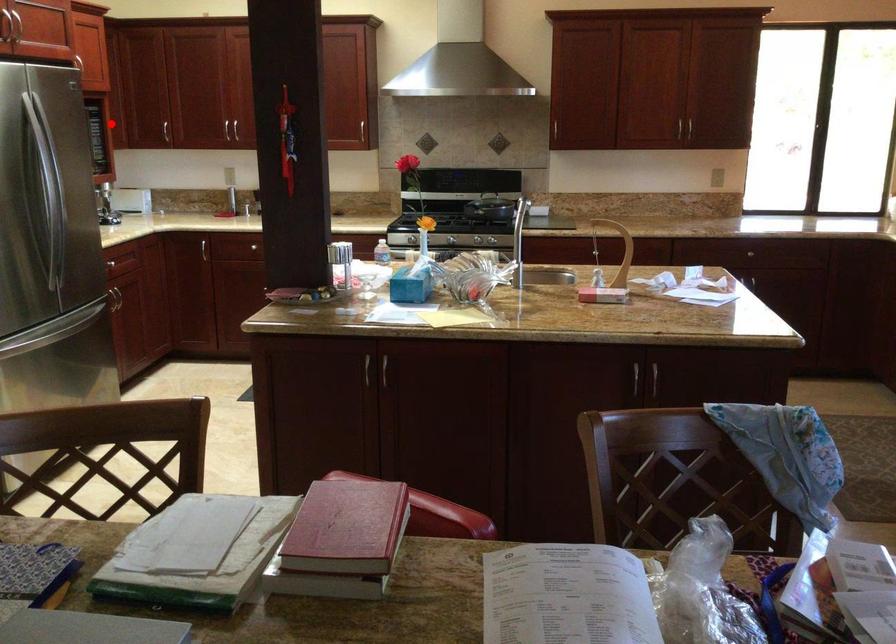
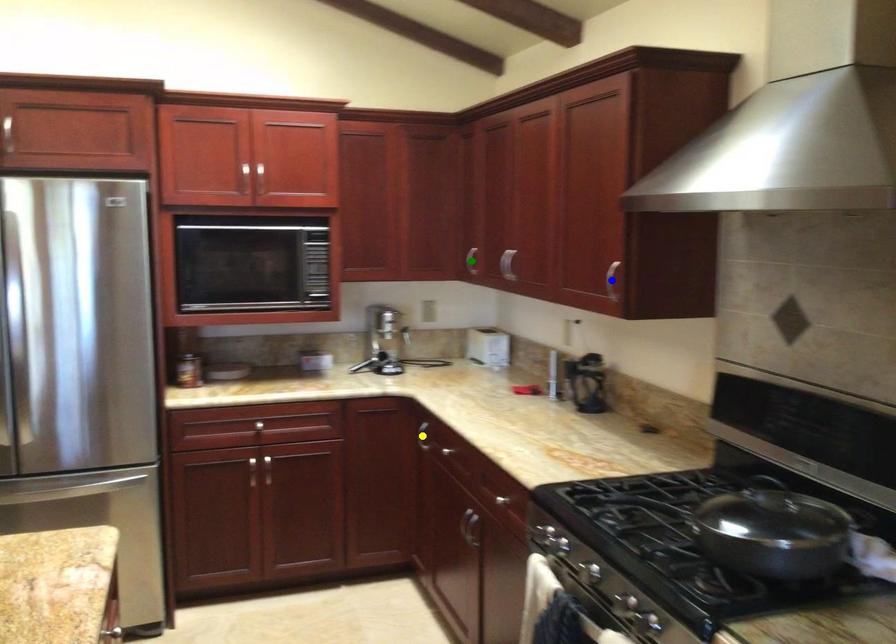
Question: I am providing you with two images of the same scene from different viewpoints. A red point is marked on the first image. You are given multiple points on the second image. Which spot in image 2 lines up with the point in image 1?

Choices:
 (A) yellow point
 (B) green point
 (C) blue point

Answer: (B)